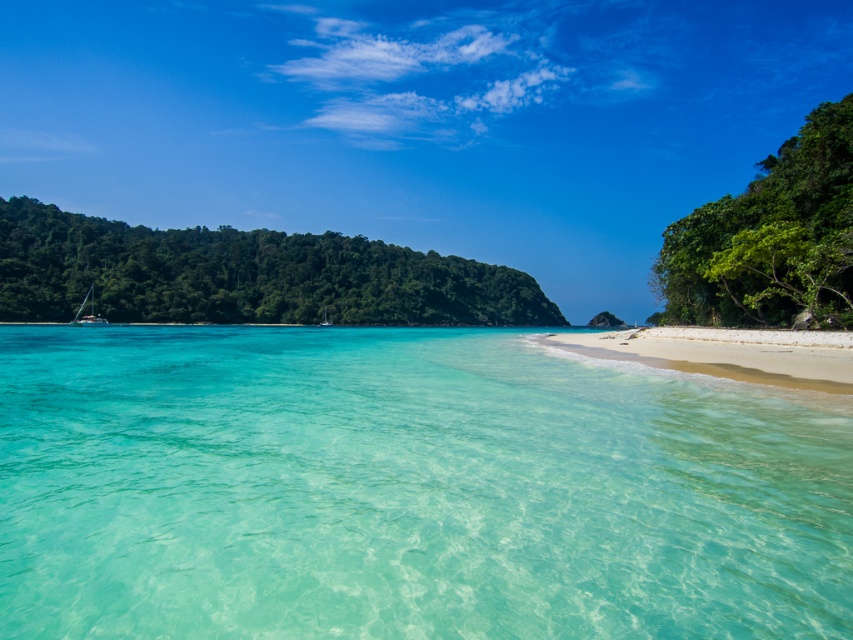
Is green leafy island at left above white glossy sailboat at left?

Correct, green leafy island at left is located above white glossy sailboat at left.

Which is below, green leafy island at left or white glossy sailboat at left?

Positioned lower is white glossy sailboat at left.

Where is `green leafy island at left`? The width and height of the screenshot is (853, 640). green leafy island at left is located at coordinates (245, 275).

Consider the image. Does transparent water at center appear over green leafy island at left?

No.

Between point (642, 445) and point (117, 284), which one is positioned behind?

Positioned behind is point (117, 284).

Is point (117, 426) farther from camera compared to point (74, 296)?

No, it is not.

Locate an element on the screen. transparent water at center is located at coordinates (407, 490).

Looking at this image, does white sand beach at lower right appear under white glossy boat at center?

Correct, white sand beach at lower right is located below white glossy boat at center.

The height and width of the screenshot is (640, 853). What do you see at coordinates (732, 358) in the screenshot?
I see `white sand beach at lower right` at bounding box center [732, 358].

Describe the element at coordinates (732, 358) in the screenshot. I see `white sand beach at lower right` at that location.

Where is `white sand beach at lower right`? The height and width of the screenshot is (640, 853). white sand beach at lower right is located at coordinates (732, 358).